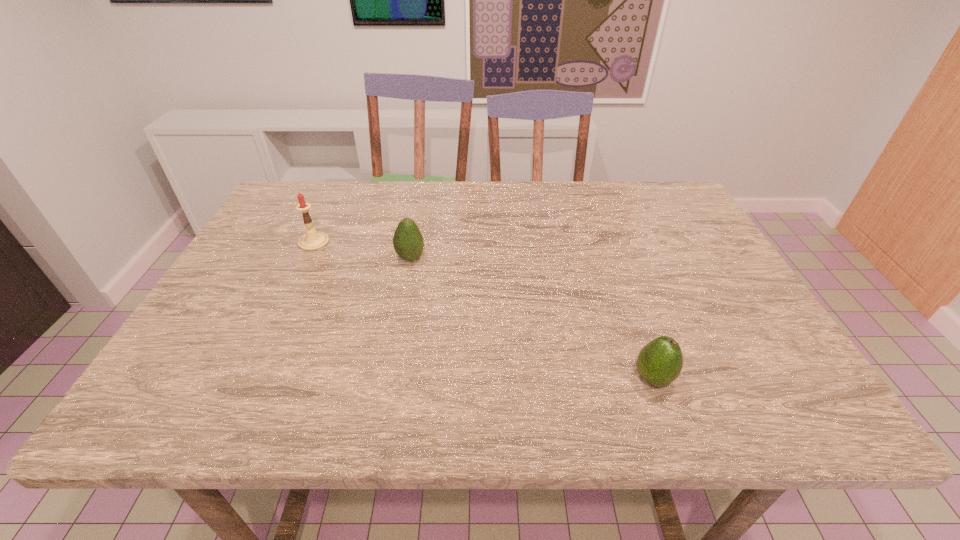
In order to click on object that is positioned at the left edge in this screenshot , I will do `click(312, 240)`.

The height and width of the screenshot is (540, 960). I want to click on free location at the far edge, so click(614, 196).

This screenshot has width=960, height=540. Identify the location of free region at the near edge of the desktop. (510, 403).

You are a GUI agent. You are given a task and a screenshot of the screen. Output one action in this format:
    pyautogui.click(x=<x>, y=<y>)
    Task: Click on the blank space at the left edge of the desktop
    This screenshot has width=960, height=540.
    Given the screenshot: What is the action you would take?
    pyautogui.click(x=233, y=335)

Locate an element on the screen. The width and height of the screenshot is (960, 540). vacant area at the right edge is located at coordinates (712, 299).

Locate an element on the screen. The height and width of the screenshot is (540, 960). free space at the far left corner of the desktop is located at coordinates pos(271,223).

Where is `vacant region at the near left corner of the desktop`? vacant region at the near left corner of the desktop is located at coordinates click(x=196, y=421).

In the image, there is a desktop. Identify the location of vacant space at the far right corner. The height and width of the screenshot is (540, 960). (668, 218).

Image resolution: width=960 pixels, height=540 pixels. In the image, there is a desktop. In order to click on vacant space at the near right corner in this screenshot , I will do (754, 397).

The width and height of the screenshot is (960, 540). I want to click on vacant space that's between the nearest object and the left avocado, so click(x=532, y=318).